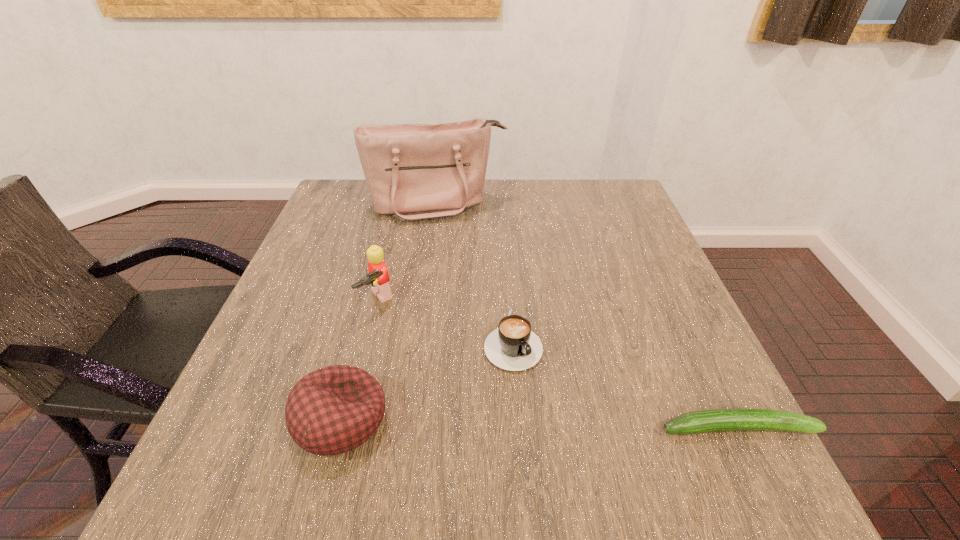
You are a GUI agent. You are given a task and a screenshot of the screen. Output one action in this format:
    pyautogui.click(x=<x>, y=<y>)
    Task: Click on the shoulder bag that is at the left edge
    The image size is (960, 540).
    Given the screenshot: What is the action you would take?
    tap(414, 172)

This screenshot has width=960, height=540. In order to click on object that is positioned at the right edge in this screenshot , I will do `click(703, 421)`.

Where is `object present at the far left corner`? object present at the far left corner is located at coordinates (414, 172).

Image resolution: width=960 pixels, height=540 pixels. In order to click on object that is at the near left corner in this screenshot , I will do `click(335, 409)`.

Locate an element on the screen. object that is at the near right corner is located at coordinates (703, 421).

Locate an element on the screen. This screenshot has height=540, width=960. vacant space at the near edge of the desktop is located at coordinates (425, 408).

In the image, there is a desktop. Identify the location of vacant region at the left edge. (240, 377).

What are the coordinates of `vacant space at the right edge of the desktop` in the screenshot? It's located at (639, 356).

I want to click on free space at the far left corner of the desktop, so click(x=356, y=181).

Image resolution: width=960 pixels, height=540 pixels. Identify the location of free region at the far right corner of the desktop. (606, 204).